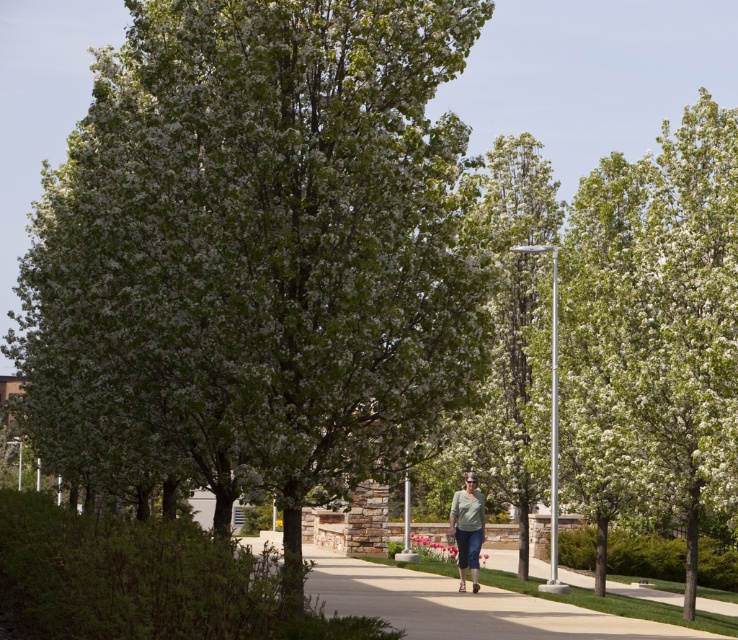
You are standing at the entrance of a garden path and see a person wearing a light green fabric shirt at center and a smooth concrete sidewalk at center. Which object is located to the right of the other?

The smooth concrete sidewalk at center is positioned on the right side of light green fabric shirt at center.

You are standing at the entrance of the pathway and want to take a photo of the green leafy tree at center and the light green fabric shirt at center. Which object should you focus on first to ensure both are in sharp focus?

You should focus on the green leafy tree at center first because it is closer to you than the light green fabric shirt at center, so focusing on the tree will help ensure both are in focus.